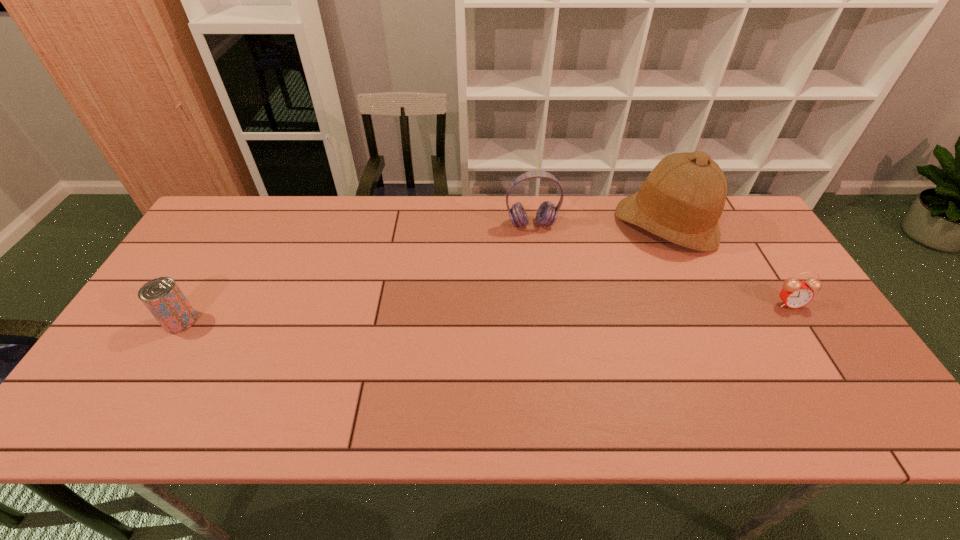
This screenshot has height=540, width=960. Find the location of `beer can`. beer can is located at coordinates pos(163,298).

The width and height of the screenshot is (960, 540). Identify the location of the rightmost object. (795, 294).

At what (x,y) coordinates should I click in order to perform the action: click on the second tallest object. Please return your answer as a coordinate pair (x, y). Looking at the image, I should click on (547, 213).

Identify the location of headset. (547, 213).

Where is `the tallest object`? The width and height of the screenshot is (960, 540). the tallest object is located at coordinates (682, 199).

You are a GUI agent. You are given a task and a screenshot of the screen. Output one action in this format:
    pyautogui.click(x=<x>, y=<y>)
    Task: Click on the third object from left to right
    
    Given the screenshot: What is the action you would take?
    click(682, 199)

This screenshot has width=960, height=540. In order to click on vacant space located on the back of the leftmost object in this screenshot , I will do `click(226, 246)`.

Locate an element on the screen. Image resolution: width=960 pixels, height=540 pixels. free region located 0.170m on the clock face of the alarm clock is located at coordinates (828, 364).

The height and width of the screenshot is (540, 960). What are the coordinates of `vacant region located 0.100m on the headband and ear cups of the headset` in the screenshot? It's located at (539, 254).

Locate an element on the screen. vacant area situated on the headband and ear cups of the headset is located at coordinates (550, 308).